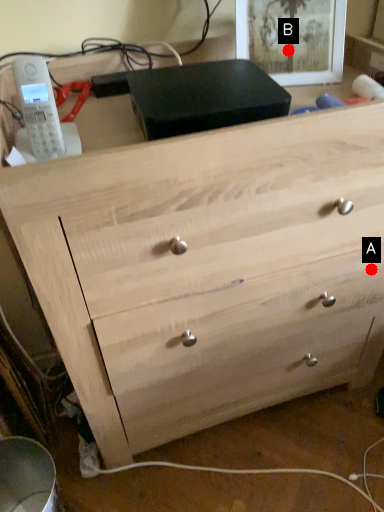
Question: Two points are circled on the image, labeled by A and B beside each circle. Which point appears farthest from the camera in this image?

Choices:
 (A) A is further
 (B) B is further

Answer: (A)